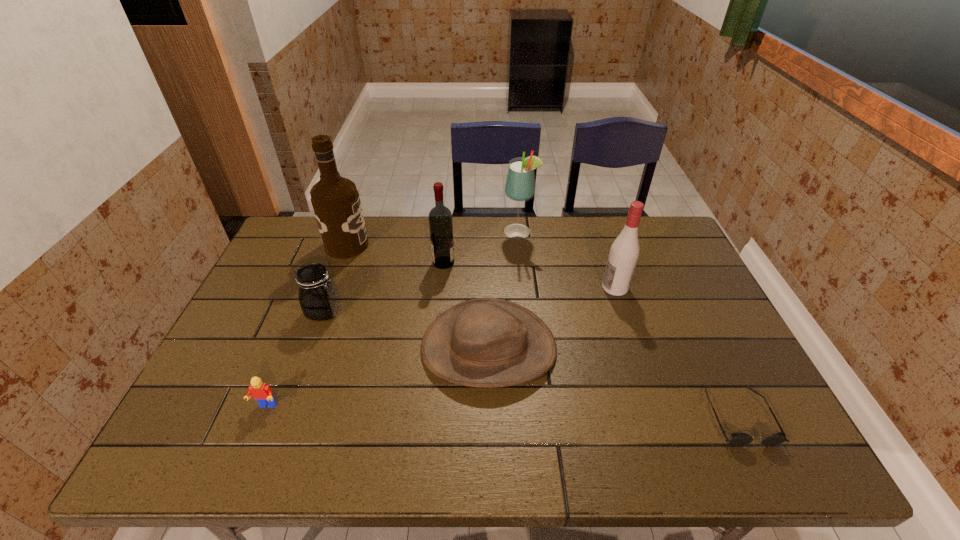
I want to click on vacant space at the near left corner of the desktop, so click(x=162, y=465).

Locate an element on the screen. Image resolution: width=960 pixels, height=540 pixels. free region at the far right corner is located at coordinates click(625, 222).

In the image, there is a desktop. At what (x,y) coordinates should I click in order to perform the action: click on vacant space at the near right corner. Please return your answer as a coordinate pair (x, y). The image size is (960, 540). Looking at the image, I should click on (730, 453).

At what (x,y) coordinates should I click in order to perform the action: click on free spot between the leftmost alcohol and the second alcohol from left to right. Please return your answer as a coordinate pair (x, y). Image resolution: width=960 pixels, height=540 pixels. Looking at the image, I should click on (396, 254).

I want to click on unoccupied area between the cowboy hat and the Lego, so click(x=377, y=377).

This screenshot has width=960, height=540. In order to click on empty location between the Lego and the cowboy hat in this screenshot , I will do `click(377, 377)`.

Find the location of a particular element. Image resolution: width=960 pixels, height=540 pixels. vacant space in between the fifth tallest object and the cowboy hat is located at coordinates (406, 330).

You are a GUI agent. You are given a task and a screenshot of the screen. Output one action in this format:
    pyautogui.click(x=<x>, y=<y>)
    Task: Click on the vacant area between the leftmost alcohol and the third alcohol from right to left
    The height and width of the screenshot is (540, 960).
    Given the screenshot: What is the action you would take?
    pyautogui.click(x=396, y=254)

Identify the location of unoccupied position between the Lego and the cowboy hat. The height and width of the screenshot is (540, 960). (377, 377).

I want to click on unoccupied area between the rightmost object and the rightmost alcohol, so click(x=677, y=352).